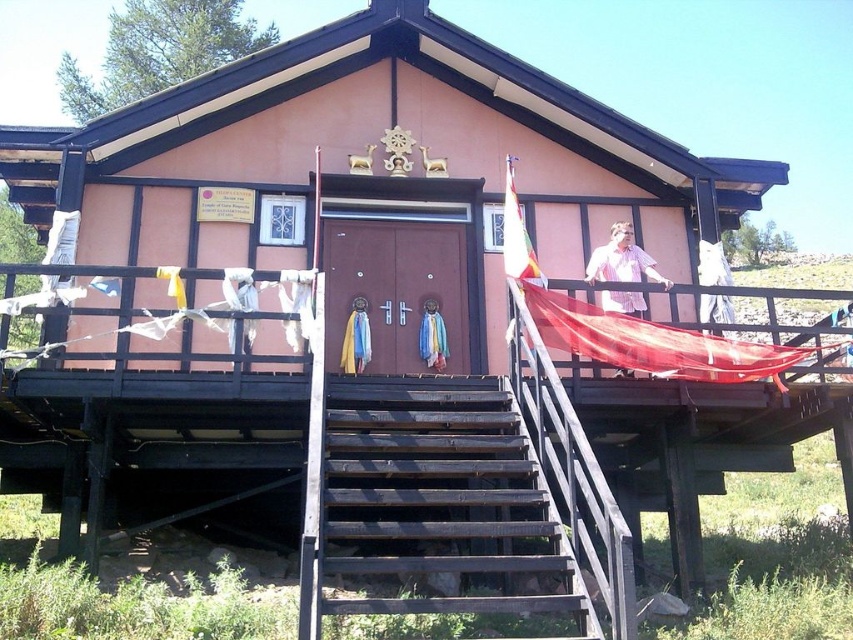
You are standing at the base of the dark brown wooden stairs at center in front of the traditional building. To reach the front door, should you walk up or down the stairs?

You should walk up the dark brown wooden stairs at center to reach the front door since the building is elevated on stilts, and the stairs lead upwards to the entrance.

You are standing at the base of the dark brown wooden stairs at center and looking towards the building entrance. Can you see the pink striped shirt at upper center from your current position?

Yes, because the dark brown wooden stairs at center is in front of the pink striped shirt at upper center, so the pink striped shirt at upper center is behind the stairs and visible from the base.

You are standing in front of the traditional building and want to determine the relative positions of two points marked on the structure. Which point is closer to you, point at coordinates (450, 513) or point at coordinates (602, 308)?

Point at coordinates (450, 513) is closer to you because it is further to the viewer than point at coordinates (602, 308).